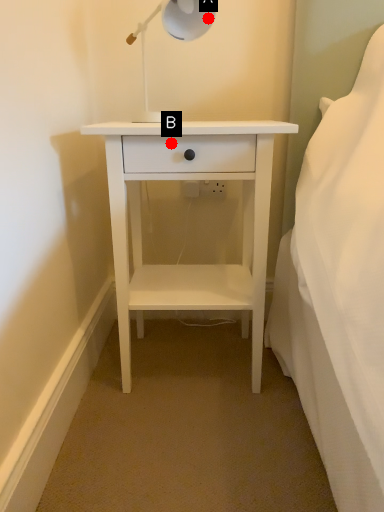
Question: Two points are circled on the image, labeled by A and B beside each circle. Which point is closer to the camera?

Choices:
 (A) A is closer
 (B) B is closer

Answer: (B)